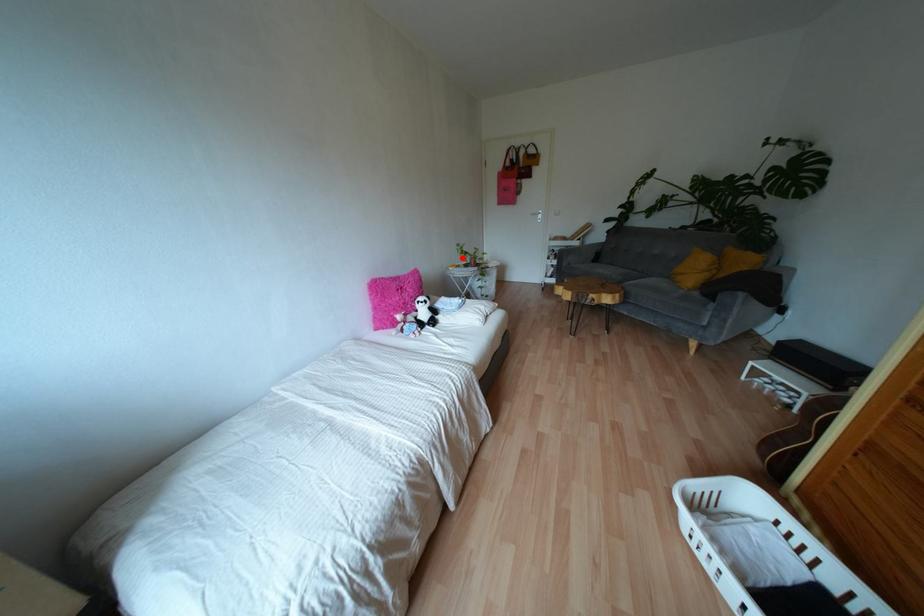
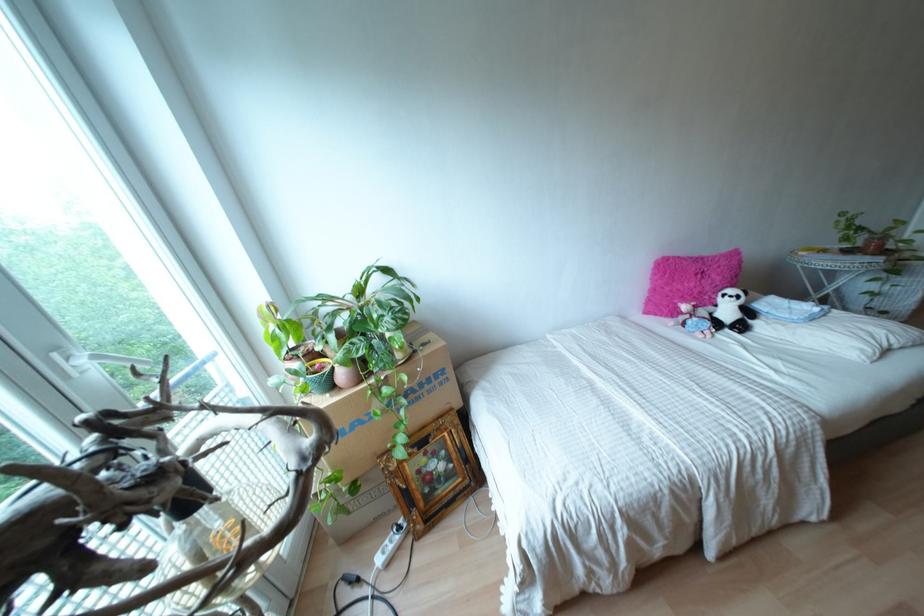
Find the pixel in the second image that matches the highlighted location in the first image.

(845, 238)